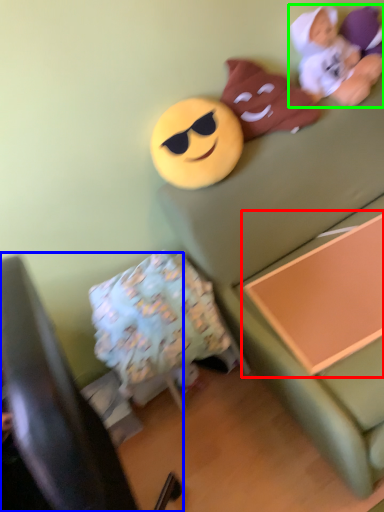
Question: Which object is the closest to the changing table (highlighted by a red box)? Choose among these: furniture (highlighted by a blue box) or toy (highlighted by a green box).

Choices:
 (A) furniture
 (B) toy

Answer: (B)